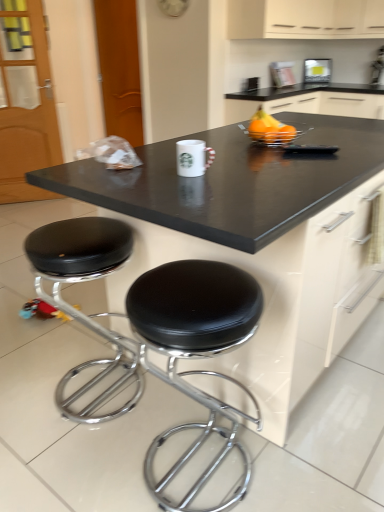
At what (x,y) coordinates should I click in order to perform the action: click on shiny orange fruit at upper right. Please return your answer as a coordinate pair (x, y). Looking at the image, I should click on coord(270,129).

What is the approximate height of black leather stool at lower left, which is the 2th stool in right-to-left order?

The height of black leather stool at lower left, which is the 2th stool in right-to-left order, is 27.90 inches.

What are the coordinates of `black leather stool at lower center, which is the 2th stool in left-to-right order` in the screenshot? It's located at (195, 352).

Find the location of `black laminate countertop at center`. black laminate countertop at center is located at coordinates (256, 239).

In order to face cream matte cabinet at upper center, should I rotate leftwards or rightwards?

You should look right and rotate roughly 14.046 degrees.

This screenshot has width=384, height=512. Find the location of `shiny orange fruit at upper right`. shiny orange fruit at upper right is located at coordinates (270, 129).

Considering the points (279, 31) and (127, 252), which point is in front, point (279, 31) or point (127, 252)?

Point (127, 252)

Is cream matte cabinet at upper center oriented away from black leather stool at lower left, positioned as the first stool in left-to-right order?

No.

Does cream matte cabinet at upper center contain black leather stool at lower left, which is the 2th stool in right-to-left order?

That's incorrect, black leather stool at lower left, which is the 2th stool in right-to-left order, is not inside cream matte cabinet at upper center.

Where is `stool that is the 1st one when counting forward from the cream matte cabinet at upper center`? Image resolution: width=384 pixels, height=512 pixels. stool that is the 1st one when counting forward from the cream matte cabinet at upper center is located at coordinates (77, 308).

Considering the relative sizes of matte plastic light at upper center and cream matte cabinet at upper center in the image provided, is matte plastic light at upper center bigger than cream matte cabinet at upper center?

No.

Between matte plastic light at upper center and cream matte cabinet at upper center, which one has more height?

cream matte cabinet at upper center is taller.

This screenshot has height=512, width=384. In order to click on cabinetry in front of the matte plastic light at upper center in this screenshot , I will do `click(305, 19)`.

Which is behind, black leather stool at lower center, which ranks as the 1th stool in right-to-left order, or cream matte cabinet at upper center?

Positioned behind is cream matte cabinet at upper center.

Would you say black leather stool at lower center, which ranks as the 1th stool in right-to-left order, contains cream matte cabinet at upper center?

No, cream matte cabinet at upper center is not inside black leather stool at lower center, which ranks as the 1th stool in right-to-left order.

Which is more to the left, black leather stool at lower center, which ranks as the 1th stool in right-to-left order, or cream matte cabinet at upper center?

From the viewer's perspective, black leather stool at lower center, which ranks as the 1th stool in right-to-left order, appears more on the left side.

Are black leather stool at lower center, which is the 2th stool in left-to-right order, and cream matte cabinet at upper center far apart?

That's right, there is a large distance between black leather stool at lower center, which is the 2th stool in left-to-right order, and cream matte cabinet at upper center.

From the image's perspective, between shiny orange fruit at upper right and black leather stool at lower left, positioned as the first stool in left-to-right order, which one is located above?

shiny orange fruit at upper right appears higher in the image.

Starting from the shiny orange fruit at upper right, which stool is the 2nd one to the left? Please provide its 2D coordinates.

[(77, 308)]

Can you tell me how much shiny orange fruit at upper right and black leather stool at lower left, positioned as the first stool in left-to-right order, differ in facing direction?

The angular difference between shiny orange fruit at upper right and black leather stool at lower left, positioned as the first stool in left-to-right order, is 89.3 degrees.

Considering the relative positions of shiny orange fruit at upper right and black leather stool at lower left, positioned as the first stool in left-to-right order, in the image provided, is shiny orange fruit at upper right in front of black leather stool at lower left, positioned as the first stool in left-to-right order,?

That is False.

Is shiny orange fruit at upper right oriented away from black leather stool at lower center, which is the 2th stool in left-to-right order?

No, black leather stool at lower center, which is the 2th stool in left-to-right order, is not at the back of shiny orange fruit at upper right.

Consider the image. Can you see shiny orange fruit at upper right touching black leather stool at lower center, which is the 2th stool in left-to-right order?

No, shiny orange fruit at upper right is not with black leather stool at lower center, which is the 2th stool in left-to-right order.

Looking at the image, does shiny orange fruit at upper right seem bigger or smaller compared to black leather stool at lower center, which is the 2th stool in left-to-right order?

Clearly, shiny orange fruit at upper right is smaller in size than black leather stool at lower center, which is the 2th stool in left-to-right order.

From the image's perspective, between shiny orange fruit at upper right and black leather stool at lower center, which ranks as the 1th stool in right-to-left order, who is located below?

black leather stool at lower center, which ranks as the 1th stool in right-to-left order.

Is black laminate countertop at center at the back of cream matte cabinet at upper center?

cream matte cabinet at upper center does not have its back to black laminate countertop at center.

Is point (336, 24) closer to viewer compared to point (365, 229)?

That is False.

Considering the relative sizes of cream matte cabinet at upper center and black laminate countertop at center in the image provided, is cream matte cabinet at upper center wider than black laminate countertop at center?

No, cream matte cabinet at upper center is not wider than black laminate countertop at center.

Is cream matte cabinet at upper center at the left side of black laminate countertop at center?

Incorrect, cream matte cabinet at upper center is not on the left side of black laminate countertop at center.

From the image's perspective, is black laminate countertop at center beneath cream matte cabinet at upper center?

Yes, from the image's perspective, black laminate countertop at center is below cream matte cabinet at upper center.

Are black laminate countertop at center and cream matte cabinet at upper center far apart?

black laminate countertop at center is positioned a significant distance from cream matte cabinet at upper center.

Which object is closer to the camera taking this photo, black laminate countertop at center or cream matte cabinet at upper center?

black laminate countertop at center.

Which is in front, point (290, 319) or point (375, 9)?

The point (290, 319) is more forward.

Which stool is the 2nd one when counting from the left side of the cream matte cabinet at upper center? Please provide its 2D coordinates.

[(77, 308)]

In the image, there is a matte plastic light at upper center. Where is `cabinetry above it (from the image's perspective)`? The image size is (384, 512). cabinetry above it (from the image's perspective) is located at coordinates (305, 19).

Looking at the image, which one is located further to matte plastic light at upper center, shiny orange fruit at upper right or cream matte cabinet at upper center?

shiny orange fruit at upper right is positioned further to the anchor matte plastic light at upper center.

Estimate the real-world distances between objects in this image. Which object is further from black leather stool at lower center, which ranks as the 1th stool in right-to-left order, matte plastic light at upper center or shiny orange fruit at upper right?

matte plastic light at upper center is positioned further to the anchor black leather stool at lower center, which ranks as the 1th stool in right-to-left order.

Looking at the image, which one is located closer to black leather stool at lower center, which is the 2th stool in left-to-right order, matte plastic light at upper center or black leather stool at lower left, which is the 2th stool in right-to-left order?

Among the two, black leather stool at lower left, which is the 2th stool in right-to-left order, is located nearer to black leather stool at lower center, which is the 2th stool in left-to-right order.

Looking at the image, which one is located further to black leather stool at lower center, which is the 2th stool in left-to-right order, black laminate countertop at center or black leather stool at lower left, which is the 2th stool in right-to-left order?

The object further to black leather stool at lower center, which is the 2th stool in left-to-right order, is black leather stool at lower left, which is the 2th stool in right-to-left order.

Estimate the real-world distances between objects in this image. Which object is closer to black leather stool at lower left, which is the 2th stool in right-to-left order, black leather stool at lower center, which is the 2th stool in left-to-right order, or matte plastic light at upper center?

black leather stool at lower center, which is the 2th stool in left-to-right order, lies closer to black leather stool at lower left, which is the 2th stool in right-to-left order, than the other object.

From the image, which object appears to be farther from cream matte cabinet at upper center, matte plastic light at upper center or black laminate countertop at center?

black laminate countertop at center is positioned further to the anchor cream matte cabinet at upper center.

Considering their positions, is matte plastic light at upper center positioned closer to shiny orange fruit at upper right than cream matte cabinet at upper center?

cream matte cabinet at upper center is positioned closer to the anchor shiny orange fruit at upper right.

Estimate the real-world distances between objects in this image. Which object is further from cream matte cabinet at upper center, black leather stool at lower center, which ranks as the 1th stool in right-to-left order, or black laminate countertop at center?

black leather stool at lower center, which ranks as the 1th stool in right-to-left order, is positioned further to the anchor cream matte cabinet at upper center.

What are the coordinates of `fruit between cream matte cabinet at upper center and black leather stool at lower left, positioned as the first stool in left-to-right order, vertically` in the screenshot? It's located at (270, 129).

You are a GUI agent. You are given a task and a screenshot of the screen. Output one action in this format:
    pyautogui.click(x=<x>, y=<y>)
    Task: Click on the fruit located between black laminate countertop at center and matte plastic light at upper center in the depth direction
    
    Given the screenshot: What is the action you would take?
    pyautogui.click(x=270, y=129)

Locate an element on the screen. countertop between shiny orange fruit at upper right and black leather stool at lower center, which ranks as the 1th stool in right-to-left order, from top to bottom is located at coordinates (256, 239).

Find the location of `countertop between cream matte cabinet at upper center and black leather stool at lower left, positioned as the first stool in left-to-right order, from top to bottom`. countertop between cream matte cabinet at upper center and black leather stool at lower left, positioned as the first stool in left-to-right order, from top to bottom is located at coordinates (256, 239).